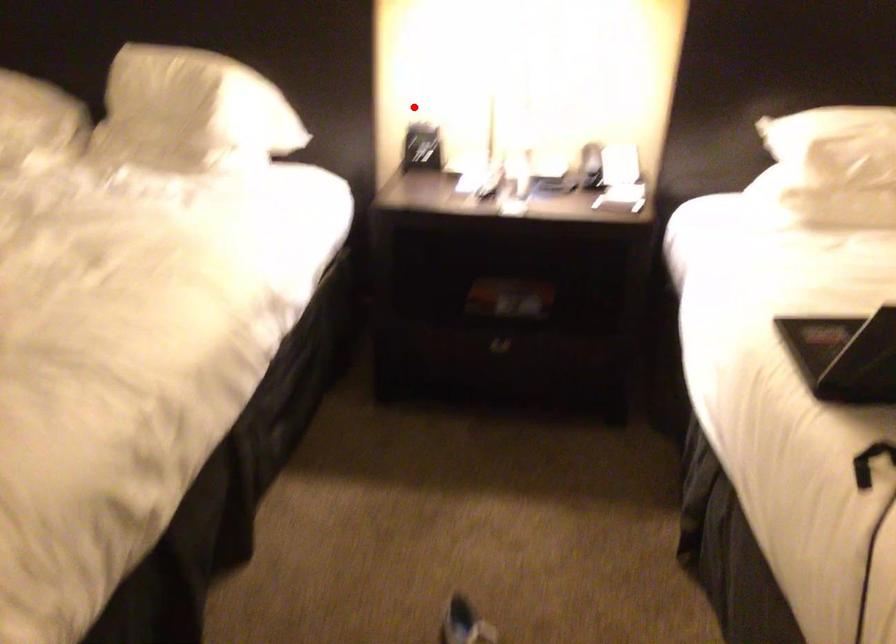
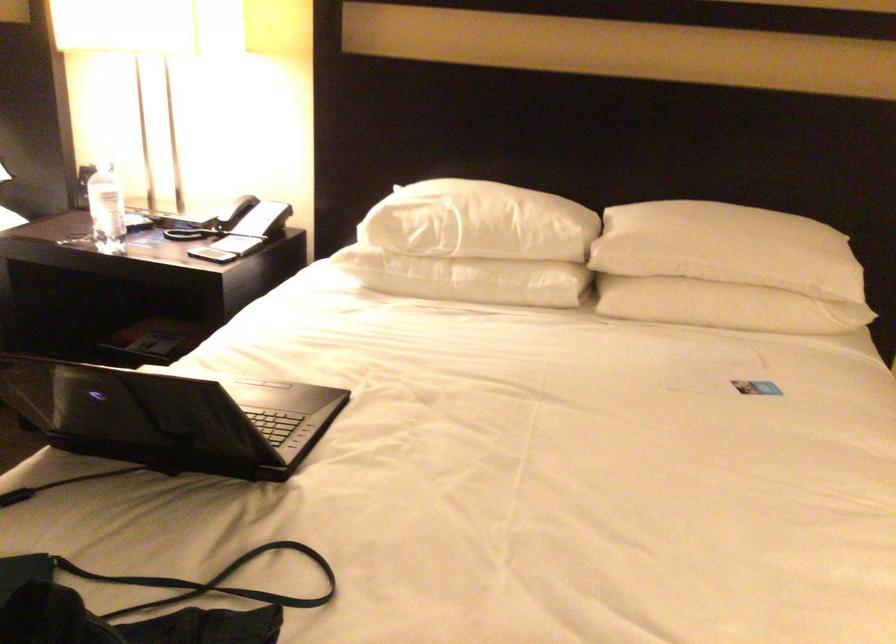
The point at the highlighted location is marked in the first image. Where is the corresponding point in the second image?

(104, 160)